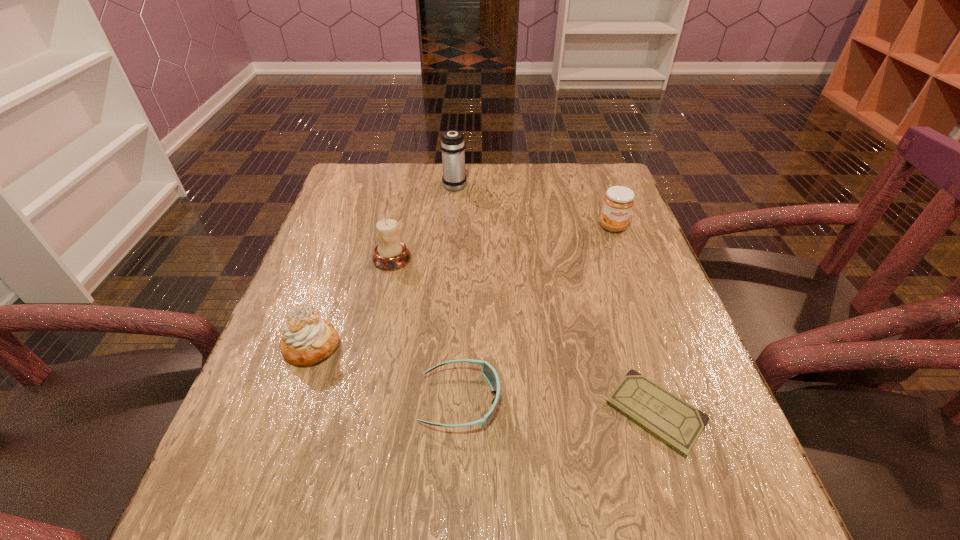
Where is `the farthest object`? the farthest object is located at coordinates (452, 144).

The height and width of the screenshot is (540, 960). Identify the location of the tallest object. (452, 144).

Identify the location of candle holder. The image size is (960, 540). (390, 254).

The image size is (960, 540). Identify the location of the fifth object from right to left. (390, 254).

Locate an element on the screen. This screenshot has height=540, width=960. the fifth nearest object is located at coordinates (618, 202).

Locate an element on the screen. the fourth farthest object is located at coordinates (307, 339).

Locate an element on the screen. This screenshot has width=960, height=540. pastry is located at coordinates (307, 339).

Image resolution: width=960 pixels, height=540 pixels. Identify the location of goggles. (488, 371).

You are a GUI agent. You are given a task and a screenshot of the screen. Output one action in this format:
    pyautogui.click(x=<x>, y=<y>)
    Task: Click on the checkbook
    
    Given the screenshot: What is the action you would take?
    pyautogui.click(x=678, y=424)

In order to click on vacant space located 0.050m on the back of the fifth object from right to left in this screenshot , I will do `click(397, 234)`.